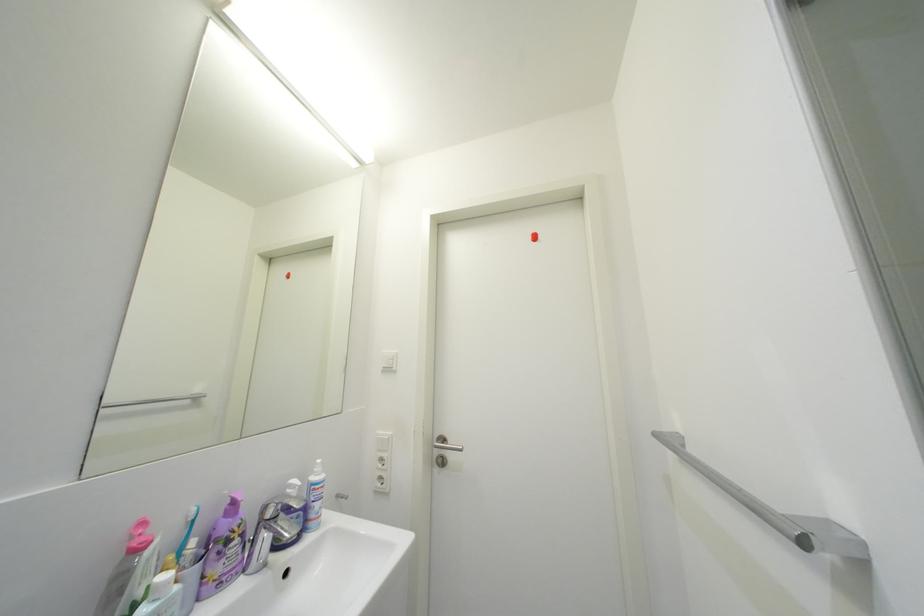
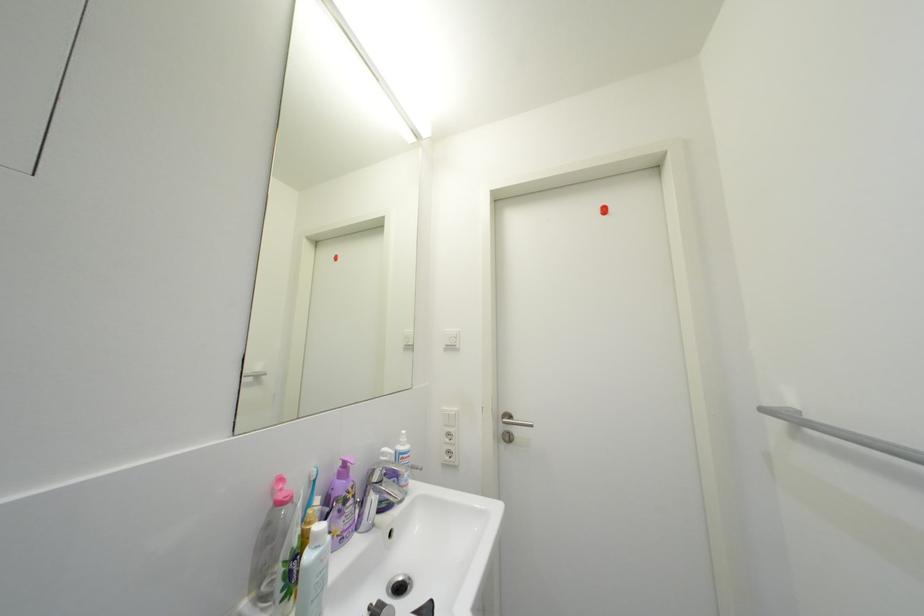
Question: How did the camera likely rotate?

Choices:
 (A) Left
 (B) Right
 (C) Up
 (D) Down

Answer: (D)